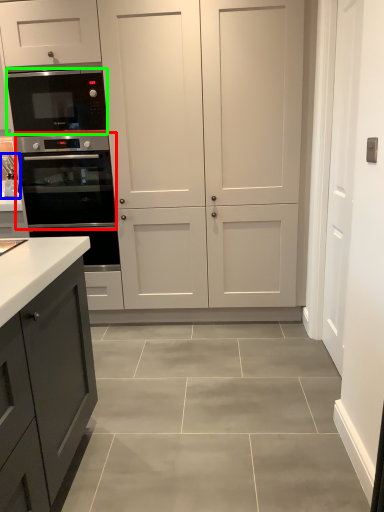
Question: Estimate the real-world distances between objects in this image. Which object is closer to oven (highlighted by a red box), sink (highlighted by a blue box) or microwave oven (highlighted by a green box)?

Choices:
 (A) sink
 (B) microwave oven

Answer: (B)